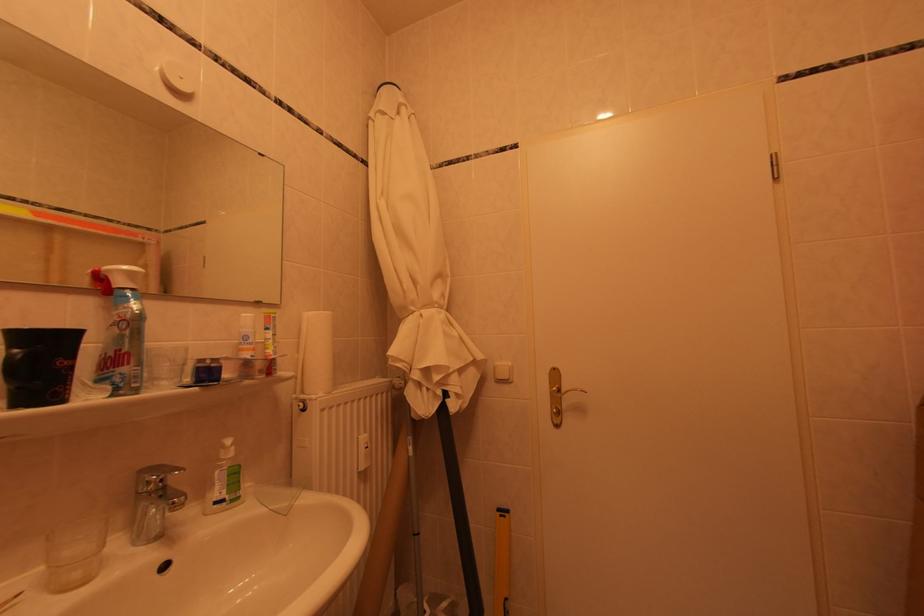
Find the location of a particular element. The image size is (924, 616). small blue container is located at coordinates (39, 365).